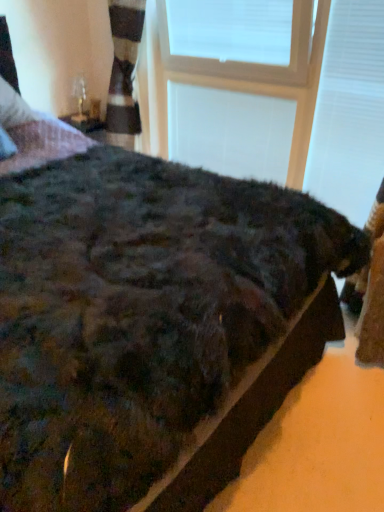
Question: Which direction should I rotate to face white plastic window frame at upper center, which appears as the 1th window frame when viewed from the back, — up or down?

Choices:
 (A) up
 (B) down

Answer: (A)

Question: From a real-world perspective, is white plastic window frame at upper center, acting as the second window frame starting from the front, on top of clear glass table lamp at upper left?

Choices:
 (A) no
 (B) yes

Answer: (A)

Question: Can you confirm if white plastic window frame at upper center, acting as the second window frame starting from the front, is smaller than clear glass table lamp at upper left?

Choices:
 (A) no
 (B) yes

Answer: (A)

Question: Does white plastic window frame at upper center, acting as the second window frame starting from the front, have a greater width compared to clear glass table lamp at upper left?

Choices:
 (A) yes
 (B) no

Answer: (B)

Question: Is the surface of white plastic window frame at upper center, which appears as the 1th window frame when viewed from the back, in direct contact with clear glass table lamp at upper left?

Choices:
 (A) no
 (B) yes

Answer: (A)

Question: Can you confirm if white plastic window frame at upper center, which appears as the 1th window frame when viewed from the back, is shorter than clear glass table lamp at upper left?

Choices:
 (A) no
 (B) yes

Answer: (A)

Question: From a real-world perspective, does white plastic window frame at upper center, acting as the second window frame starting from the front, sit lower than clear glass table lamp at upper left?

Choices:
 (A) yes
 (B) no

Answer: (A)

Question: From the image's perspective, is clear glass table lamp at upper left on top of white plastic window frame at upper center, acting as the second window frame starting from the front?

Choices:
 (A) no
 (B) yes

Answer: (B)

Question: Is clear glass table lamp at upper left positioned beyond the bounds of white plastic window frame at upper center, which appears as the 1th window frame when viewed from the back?

Choices:
 (A) no
 (B) yes

Answer: (B)

Question: Is the depth of clear glass table lamp at upper left less than that of white plastic window frame at upper center, which appears as the 1th window frame when viewed from the back?

Choices:
 (A) yes
 (B) no

Answer: (B)

Question: Does clear glass table lamp at upper left appear on the right side of white plastic window frame at upper center, acting as the second window frame starting from the front?

Choices:
 (A) no
 (B) yes

Answer: (A)

Question: From a real-world perspective, does clear glass table lamp at upper left sit lower than white plastic window frame at upper center, acting as the second window frame starting from the front?

Choices:
 (A) yes
 (B) no

Answer: (B)

Question: Is clear glass table lamp at upper left not close to white plastic window frame at upper center, which appears as the 1th window frame when viewed from the back?

Choices:
 (A) no
 (B) yes

Answer: (A)

Question: Are white plastic window frame at upper center, acting as the second window frame starting from the front, and white plastic window frame at upper center, acting as the second window frame starting from the back, beside each other?

Choices:
 (A) no
 (B) yes

Answer: (A)